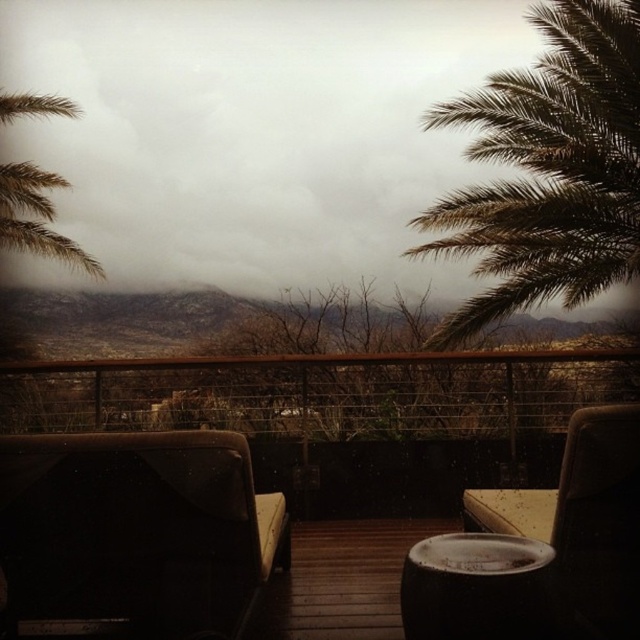
You are standing on the wooden deck at center and want to sit down. Which object, the dark brown leather armchair at lower left or another chair, is positioned higher and thus offers a better view of the desert landscape?

The dark brown leather armchair at lower left is above the wooden deck at center, so it is positioned higher and offers a better view of the desert landscape.

You are standing on the wooden deck at center and looking towards the green leafy palm tree at upper right. Which object appears taller from your vantage point?

The green leafy palm tree at upper right appears taller than the wooden deck at center from your vantage point.

You are a delivery robot with a package that is 1 meter wide. You need to move from the edge of the deck to the dark brown leather armchair at lower left while avoiding the smooth dark brown stool at center. Can you fit through the space between them?

The dark brown leather armchair at lower left and smooth dark brown stool at center are 99.28 centimeters apart, which is less than the 1 meter width of the robot. Therefore, the robot cannot fit through the space between them.